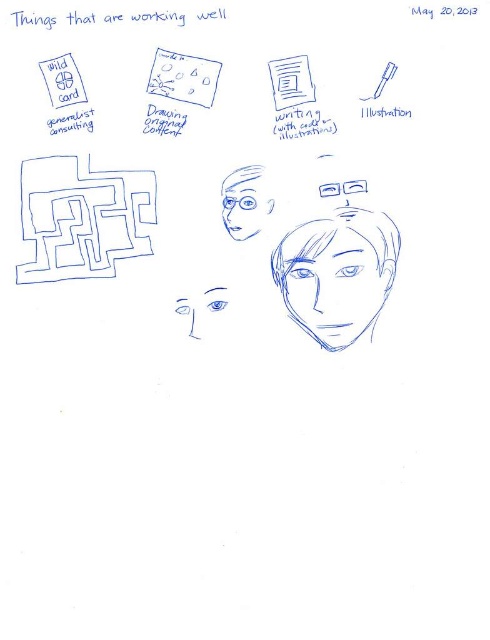
Question: Is the position of smooth skin face at center more distant than that of blue sketchy face at center?

Choices:
 (A) yes
 (B) no

Answer: (B)

Question: Is smooth skin face at center behind blue matte glasses at center?

Choices:
 (A) yes
 (B) no

Answer: (A)

Question: Which of these objects is positioned closest to the blue matte glasses at center?

Choices:
 (A) smooth skin face at center
 (B) blue line art maze at upper left

Answer: (A)

Question: Does blue matte glasses at center have a lesser width compared to blue sketchy face at center?

Choices:
 (A) no
 (B) yes

Answer: (B)

Question: Based on their relative distances, which object is farther from the blue sketchy face at center?

Choices:
 (A) blue line art maze at upper left
 (B) blue matte glasses at center
 (C) smooth skin face at center

Answer: (A)

Question: Which object is the closest to the blue line art maze at upper left?

Choices:
 (A) smooth skin face at center
 (B) blue matte glasses at center

Answer: (B)